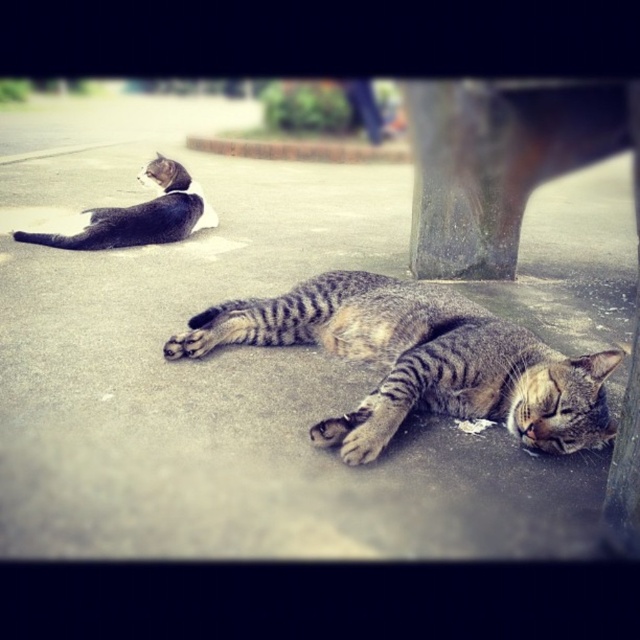
Question: Which object is closer to the camera taking this photo?

Choices:
 (A) striped fur cat at upper left
 (B) striped fur cat at center
 (C) gray concrete pavement at center

Answer: (C)

Question: Considering the real-world distances, which object is farthest from the striped fur cat at center?

Choices:
 (A) gray concrete pavement at center
 (B) striped fur cat at upper left

Answer: (B)

Question: Does gray concrete pavement at center appear over striped fur cat at center?

Choices:
 (A) yes
 (B) no

Answer: (A)

Question: Is gray concrete pavement at center positioned before striped fur cat at upper left?

Choices:
 (A) yes
 (B) no

Answer: (A)

Question: Does gray concrete pavement at center appear on the right side of striped fur cat at upper left?

Choices:
 (A) no
 (B) yes

Answer: (B)

Question: Which object is positioned farthest from the striped fur cat at upper left?

Choices:
 (A) striped fur cat at center
 (B) gray concrete pavement at center

Answer: (A)